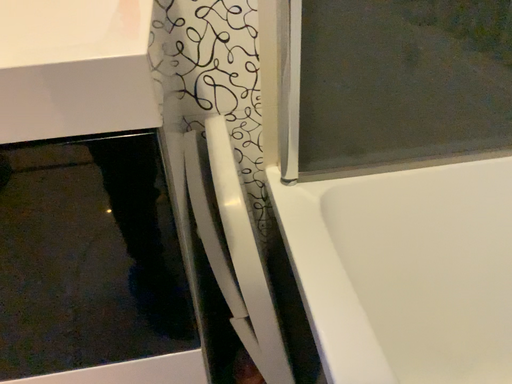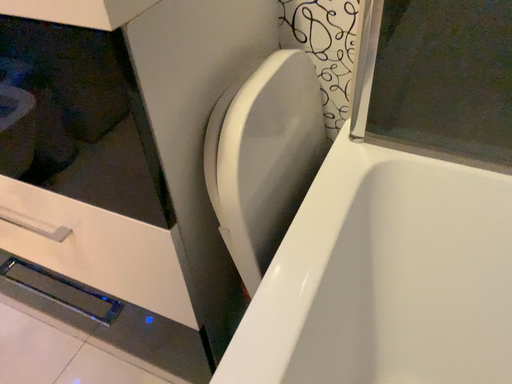
Question: How did the camera likely rotate when shooting the video?

Choices:
 (A) rotated right
 (B) rotated left

Answer: (B)